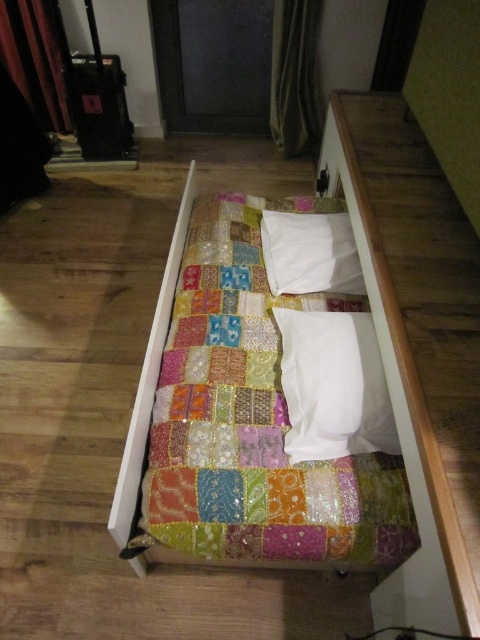
Who is taller, patchwork fabric bed at center or white soft pillow at upper center?

patchwork fabric bed at center

Who is more distant from viewer, (180, 536) or (336, 264)?

The point (336, 264) is behind.

At what (x,y) coordinates should I click in order to perform the action: click on patchwork fabric bed at center. Please return your answer as a coordinate pair (x, y). The image size is (480, 640). Looking at the image, I should click on [x=240, y=417].

Is white soft pillow at center taller than white soft pillow at upper center?

Yes, white soft pillow at center is taller than white soft pillow at upper center.

Between white soft pillow at center and white soft pillow at upper center, which one is positioned lower?

white soft pillow at center is lower down.

Does point (362, 339) come farther from viewer compared to point (274, 241)?

No.

At what (x,y) coordinates should I click in order to perform the action: click on white soft pillow at center. Please return your answer as a coordinate pair (x, y). Image resolution: width=480 pixels, height=640 pixels. Looking at the image, I should click on (334, 385).

Can you confirm if patchwork fabric bed at center is smaller than white soft pillow at center?

Actually, patchwork fabric bed at center might be larger than white soft pillow at center.

Who is lower down, patchwork fabric bed at center or white soft pillow at center?

white soft pillow at center is below.

At what (x,y) coordinates should I click in order to perform the action: click on patchwork fabric bed at center. Please return your answer as a coordinate pair (x, y). Image resolution: width=480 pixels, height=640 pixels. Looking at the image, I should click on (240, 417).